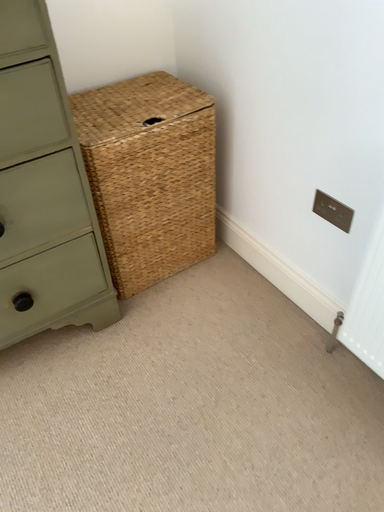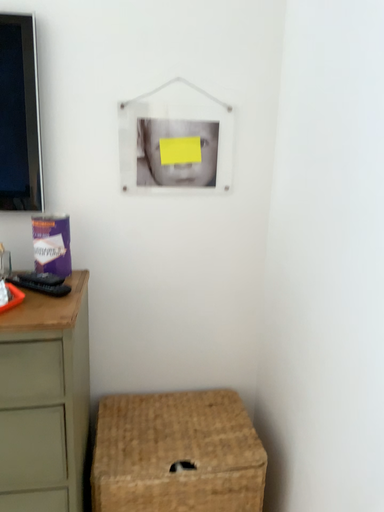
Question: Which way did the camera rotate in the video?

Choices:
 (A) rotated right
 (B) rotated left

Answer: (B)